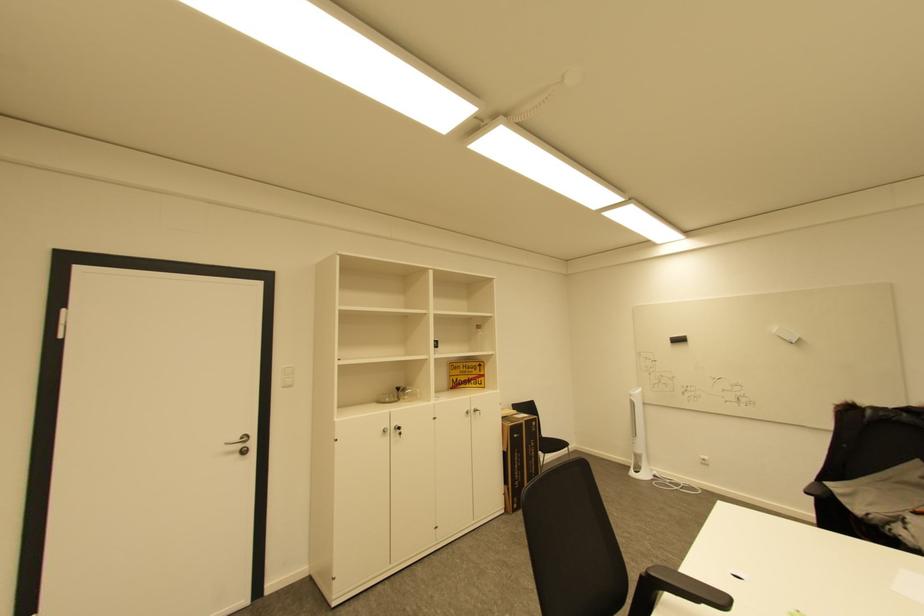
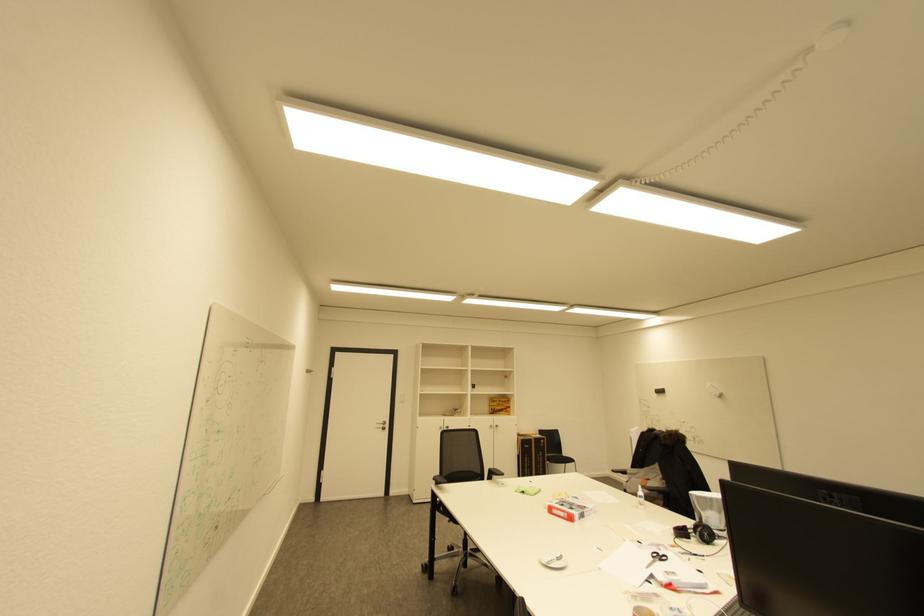
What movement of the cameraman would produce the second image?

The cameraman walked toward right, backward.